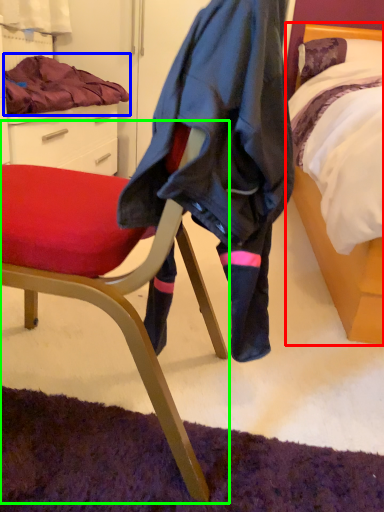
Question: Which object is the closest to the bed (highlighted by a red box)? Choose among these: blanket (highlighted by a blue box) or chair (highlighted by a green box).

Choices:
 (A) blanket
 (B) chair

Answer: (B)